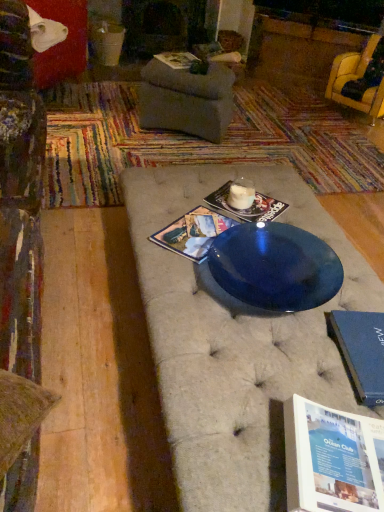
Question: Is matte paper magazine at upper center, which is the first magazine from top to bottom, at the left side of gray fabric footrest at center?

Choices:
 (A) no
 (B) yes

Answer: (B)

Question: Does matte paper magazine at upper center, which is the first magazine from top to bottom, have a smaller size compared to gray fabric footrest at center?

Choices:
 (A) no
 (B) yes

Answer: (B)

Question: From a real-world perspective, is matte paper magazine at upper center, the third magazine in the front-to-back sequence, physically above gray fabric footrest at center?

Choices:
 (A) no
 (B) yes

Answer: (B)

Question: Considering the relative sizes of matte paper magazine at upper center, which is the first magazine from back to front, and gray fabric footrest at center in the image provided, is matte paper magazine at upper center, which is the first magazine from back to front, wider than gray fabric footrest at center?

Choices:
 (A) no
 (B) yes

Answer: (A)

Question: Does matte paper magazine at upper center, the third magazine in the front-to-back sequence, have a lesser width compared to gray fabric footrest at center?

Choices:
 (A) no
 (B) yes

Answer: (B)

Question: Is matte paper magazine at center, the third magazine when ordered from top to bottom, to the left or to the right of matte paper magazine at upper center, which is the 3th magazine in bottom-to-top order, in the image?

Choices:
 (A) left
 (B) right

Answer: (B)

Question: Looking at their shapes, would you say matte paper magazine at center, arranged as the third magazine when viewed from the back, is wider or thinner than matte paper magazine at upper center, the third magazine in the front-to-back sequence?

Choices:
 (A) wide
 (B) thin

Answer: (A)

Question: Which is correct: matte paper magazine at center, which appears as the 1th magazine when viewed from the front, is inside matte paper magazine at upper center, the third magazine in the front-to-back sequence, or outside of it?

Choices:
 (A) inside
 (B) outside

Answer: (B)

Question: From the image's perspective, is matte paper magazine at center, which appears as the 1th magazine when viewed from the front, located above or below matte paper magazine at upper center, which is the first magazine from back to front?

Choices:
 (A) below
 (B) above

Answer: (A)

Question: Looking at their shapes, would you say matte paper magazine at upper center, which is the first magazine from top to bottom, is wider or thinner than matte paper magazine at center, arranged as the third magazine when viewed from the back?

Choices:
 (A) thin
 (B) wide

Answer: (A)

Question: Considering their positions, is matte paper magazine at upper center, which is the first magazine from back to front, located in front of or behind matte paper magazine at center, acting as the first magazine starting from the bottom?

Choices:
 (A) behind
 (B) front

Answer: (A)

Question: From the image's perspective, is matte paper magazine at upper center, which is the 3th magazine in bottom-to-top order, located above or below matte paper magazine at center, arranged as the third magazine when viewed from the back?

Choices:
 (A) below
 (B) above

Answer: (B)

Question: Is matte paper magazine at upper center, which is the 3th magazine in bottom-to-top order, inside or outside of matte paper magazine at center, the third magazine when ordered from top to bottom?

Choices:
 (A) outside
 (B) inside

Answer: (A)

Question: Visually, is matte paper magazine at center, the second magazine viewed from the back, positioned to the left or to the right of matte paper magazine at center, which appears as the 1th magazine when viewed from the front?

Choices:
 (A) right
 (B) left

Answer: (A)

Question: In terms of size, does matte paper magazine at center, which is counted as the second magazine, starting from the bottom, appear bigger or smaller than matte paper magazine at center, arranged as the third magazine when viewed from the back?

Choices:
 (A) big
 (B) small

Answer: (B)